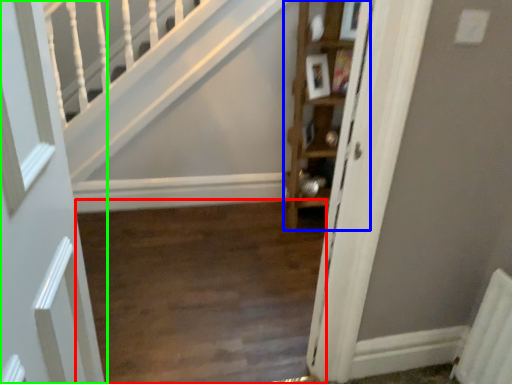
Question: Based on their relative distances, which object is nearer to corridor (highlighted by a red box)? Choose from cabinet (highlighted by a blue box) and door (highlighted by a green box).

Choices:
 (A) cabinet
 (B) door

Answer: (A)